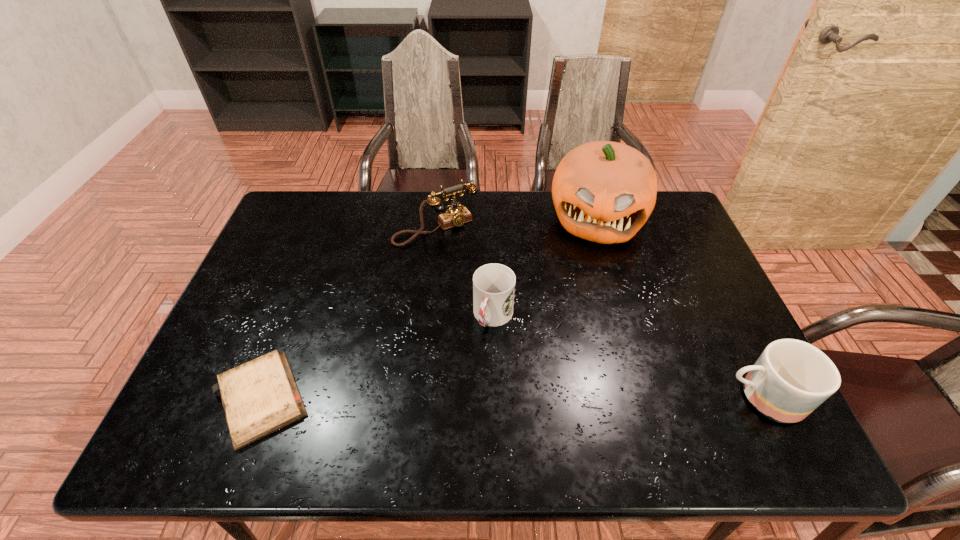
Find the location of a particular element. The image size is (960, 540). the leftmost object is located at coordinates (259, 397).

You are a GUI agent. You are given a task and a screenshot of the screen. Output one action in this format:
    pyautogui.click(x=<x>, y=<y>)
    Task: Click on the diary
    
    Given the screenshot: What is the action you would take?
    pyautogui.click(x=259, y=397)

The image size is (960, 540). I want to click on mug, so click(x=791, y=378).

What are the coordinates of `telephone` in the screenshot? It's located at (456, 216).

The image size is (960, 540). What are the coordinates of `cup` in the screenshot? It's located at (493, 284).

Where is `pumpkin`? This screenshot has width=960, height=540. pumpkin is located at coordinates (603, 191).

Find the location of a particular element. This screenshot has height=540, width=960. the tallest object is located at coordinates (603, 191).

At what (x,y) coordinates should I click in order to perform the action: click on free point located 0.120m on the back of the shortest object. Please return your answer as a coordinate pair (x, y). The image size is (960, 540). Looking at the image, I should click on (294, 315).

Locate an element on the screen. vacant space located on the side with the handle of the mug is located at coordinates (681, 397).

Image resolution: width=960 pixels, height=540 pixels. In order to click on free location located 0.310m on the side with the handle of the mug in this screenshot , I will do `click(584, 397)`.